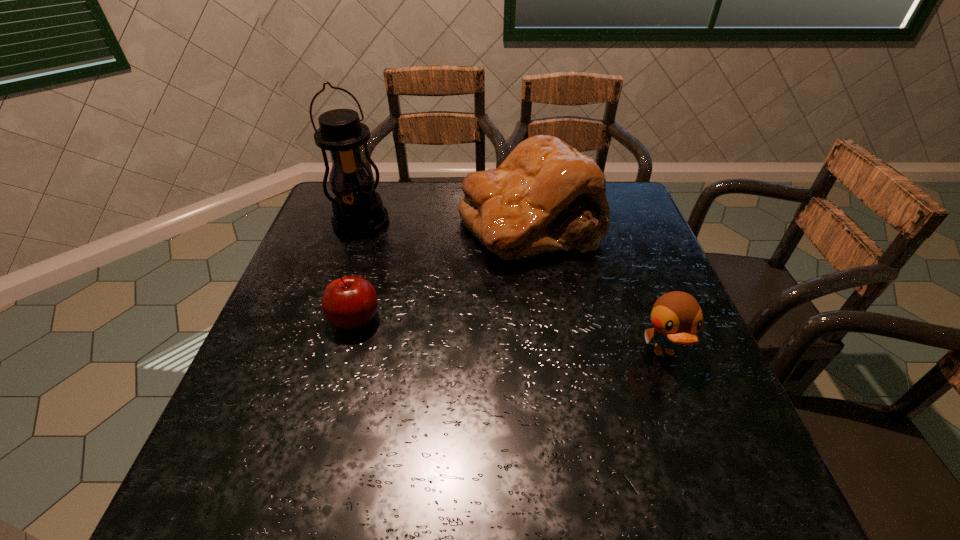
Find the location of a particular element. vacant space that satisfies the following two spatial constraints: 1. on the front side of the apple; 2. on the right side of the tallest object is located at coordinates (328, 319).